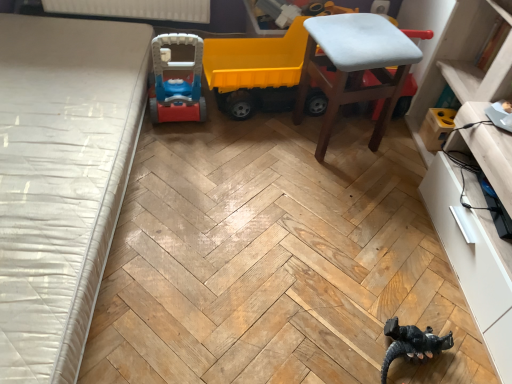
Question: In terms of height, does black matte toy dinosaur at lower right look taller or shorter compared to light blue fabric stool at upper right?

Choices:
 (A) tall
 (B) short

Answer: (B)

Question: Considering their positions, is black matte toy dinosaur at lower right located in front of or behind light blue fabric stool at upper right?

Choices:
 (A) front
 (B) behind

Answer: (A)

Question: Which is farther from the white textured mattress at left?

Choices:
 (A) white glossy dresser at lower right
 (B) yellow plastic toy truck at center
 (C) light blue fabric stool at upper right
 (D) black matte toy dinosaur at lower right

Answer: (A)

Question: Which of these objects is positioned farthest from the light blue fabric stool at upper right?

Choices:
 (A) yellow plastic toy truck at center
 (B) white glossy dresser at lower right
 (C) white textured mattress at left
 (D) black matte toy dinosaur at lower right

Answer: (C)